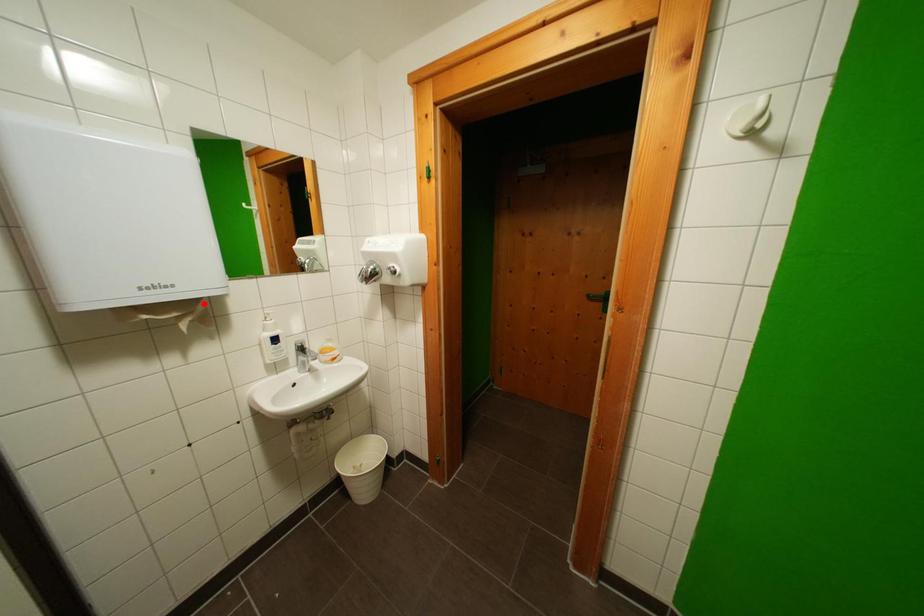
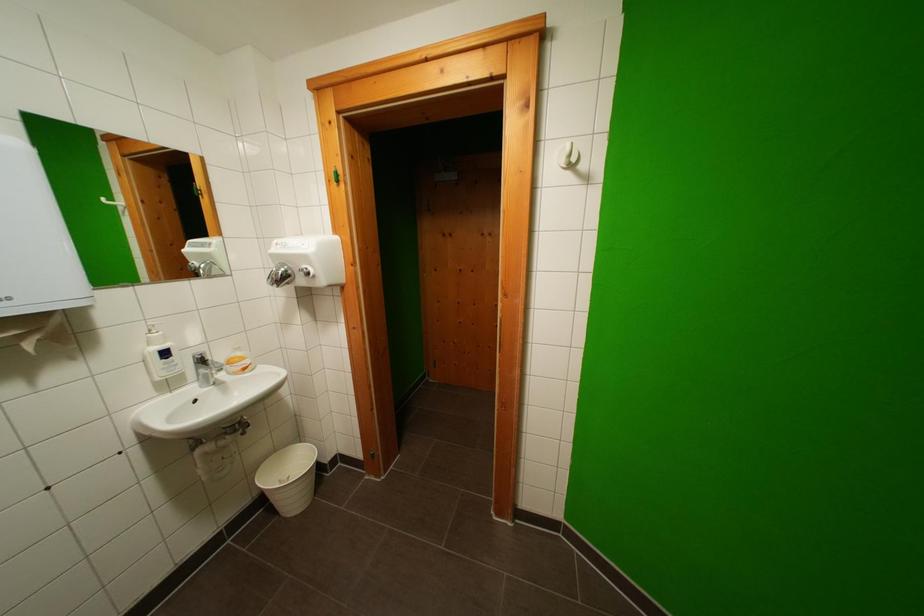
Locate, in the second image, the point that corresponds to the highlighted location in the first image.

(55, 317)